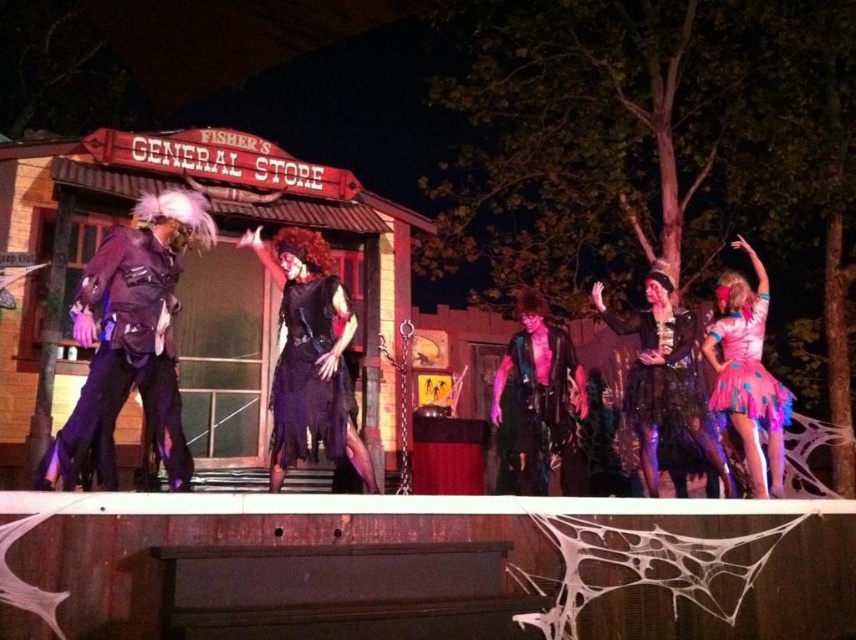
Is pink leather vest at center shorter than black velvet dress at center?

No.

Can you confirm if pink leather vest at center is smaller than black velvet dress at center?

Actually, pink leather vest at center might be larger than black velvet dress at center.

Which is behind, point (581, 404) or point (337, 419)?

Positioned behind is point (581, 404).

This screenshot has height=640, width=856. I want to click on pink leather vest at center, so click(538, 406).

Is point (242, 240) farther from viewer compared to point (310, 400)?

That is True.

Can you confirm if black lace dress at center is shorter than black velvet dress at center?

Incorrect, black lace dress at center's height does not fall short of black velvet dress at center's.

This screenshot has width=856, height=640. Describe the element at coordinates (310, 356) in the screenshot. I see `black lace dress at center` at that location.

At what (x,y) coordinates should I click in order to perform the action: click on black lace dress at center. Please return your answer as a coordinate pair (x, y). This screenshot has width=856, height=640. Looking at the image, I should click on (310, 356).

Locate an element on the screen. shiny black dress at center is located at coordinates (663, 378).

From the picture: Is shiny black dress at center shorter than shiny pink tulle skirt at right?

In fact, shiny black dress at center may be taller than shiny pink tulle skirt at right.

Identify the location of shiny black dress at center. Image resolution: width=856 pixels, height=640 pixels. (663, 378).